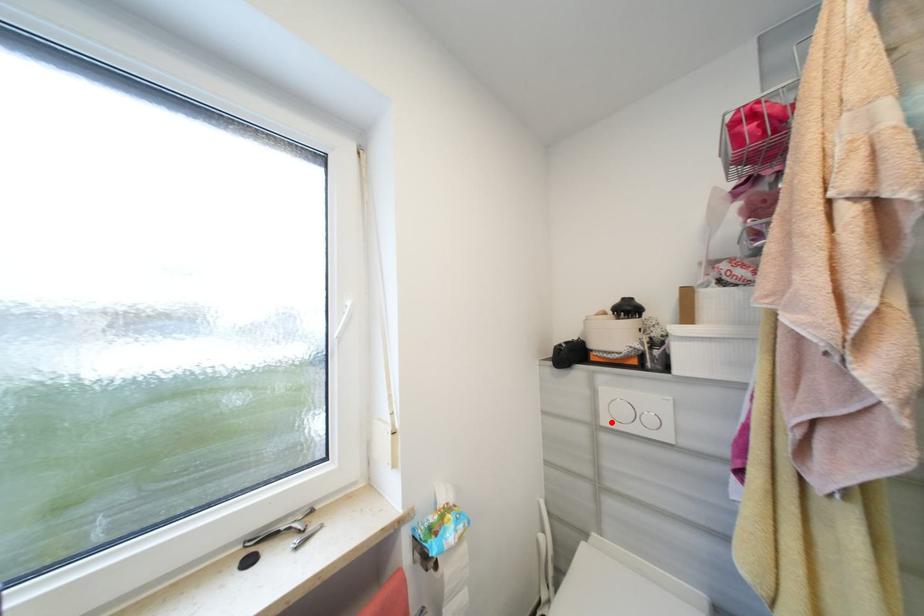
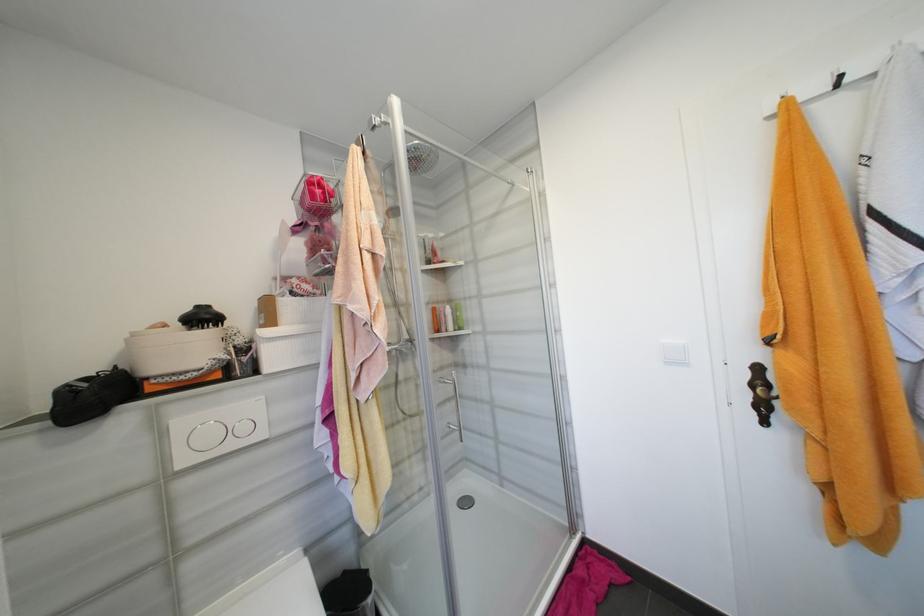
Find the pixel in the second image that matches the highlighted location in the first image.

(189, 463)